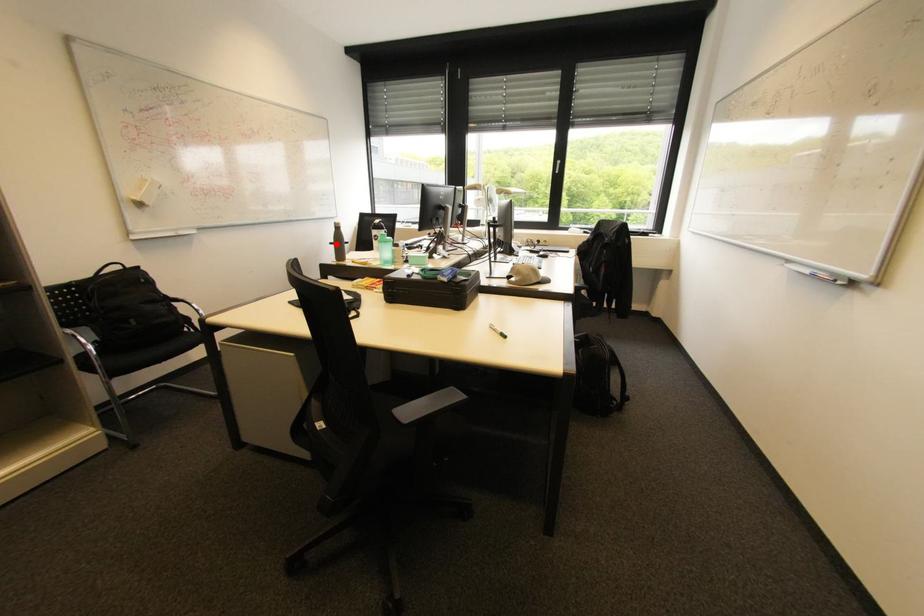
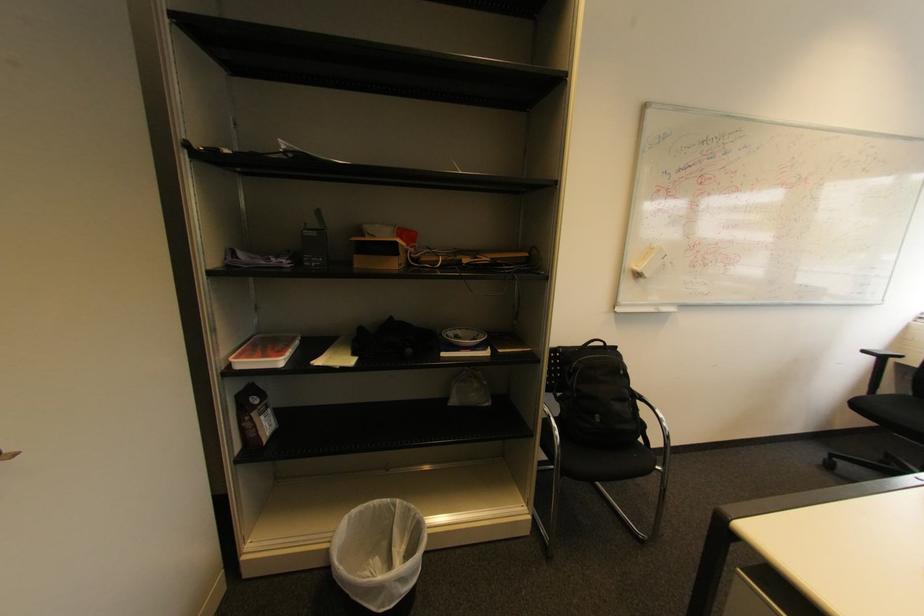
Find the pixel in the second image that matches the highlighted location in the first image.

(869, 352)